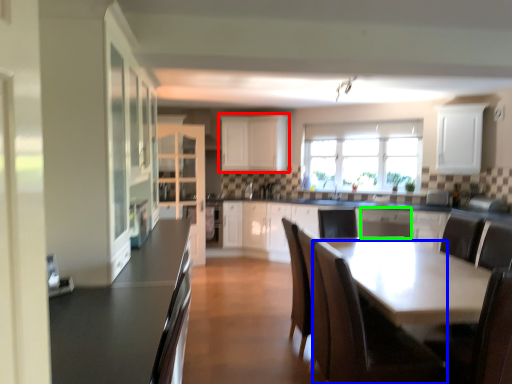
Question: Based on their relative distances, which object is nearer to cabinetry (highlighted by a red box)? Choose from chair (highlighted by a blue box) and dish washer (highlighted by a green box).

Choices:
 (A) chair
 (B) dish washer

Answer: (B)